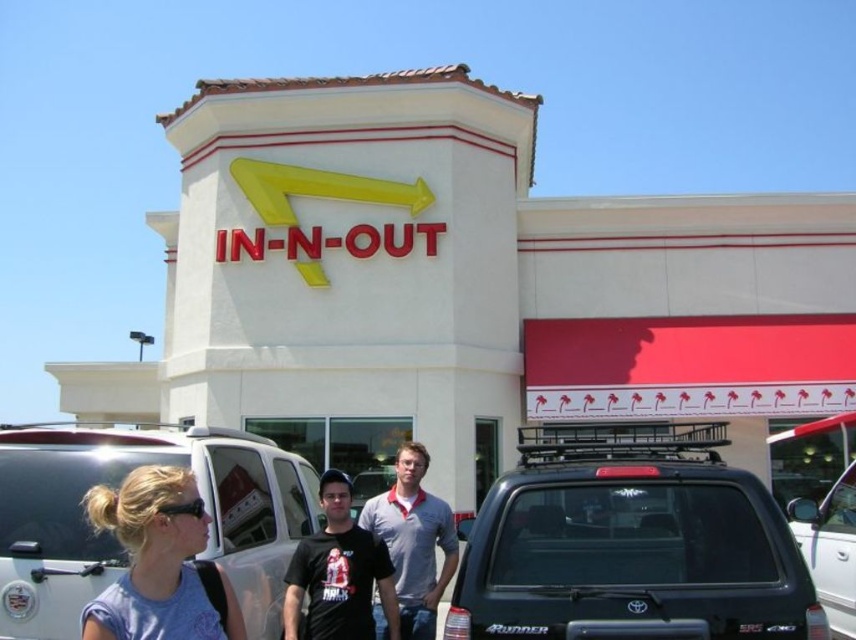
At what (x,y) coordinates should I click in order to perform the action: click on black t-shirt at center. Please return your answer as a coordinate pair (x, y). Looking at the image, I should click on (337, 573).

Between point (298, 580) and point (405, 442), which one is positioned in front?

Point (298, 580)

Describe the element at coordinates (337, 573) in the screenshot. I see `black t-shirt at center` at that location.

The image size is (856, 640). I want to click on black t-shirt at center, so click(337, 573).

Between white matte building at center and black t-shirt at center, which one is positioned higher?

white matte building at center is above.

Who is lower down, white matte building at center or black t-shirt at center?

black t-shirt at center

Does point (218, 147) lie behind point (328, 573)?

Yes.

You are a GUI agent. You are given a task and a screenshot of the screen. Output one action in this format:
    pyautogui.click(x=<x>, y=<y>)
    Task: Click on the white matte building at center
    The image size is (856, 640).
    Given the screenshot: What is the action you would take?
    (x=464, y=285)

Between white matte building at center and silver metallic suv at center, which one appears on the right side from the viewer's perspective?

white matte building at center

Does white matte building at center appear under silver metallic suv at center?

Incorrect, white matte building at center is not positioned below silver metallic suv at center.

The height and width of the screenshot is (640, 856). Describe the element at coordinates (464, 285) in the screenshot. I see `white matte building at center` at that location.

At what (x,y) coordinates should I click in order to perform the action: click on white matte building at center. Please return your answer as a coordinate pair (x, y). Image resolution: width=856 pixels, height=640 pixels. Looking at the image, I should click on (464, 285).